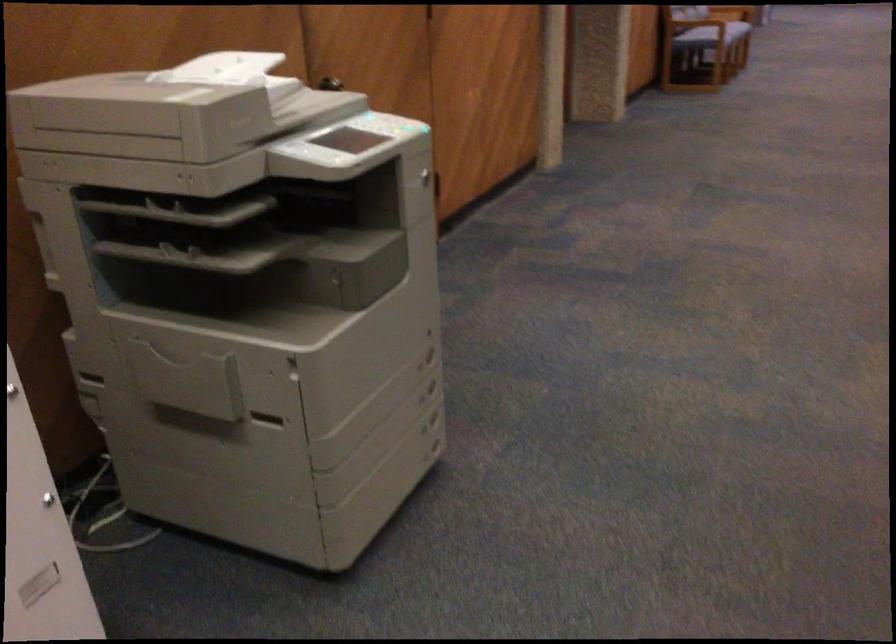
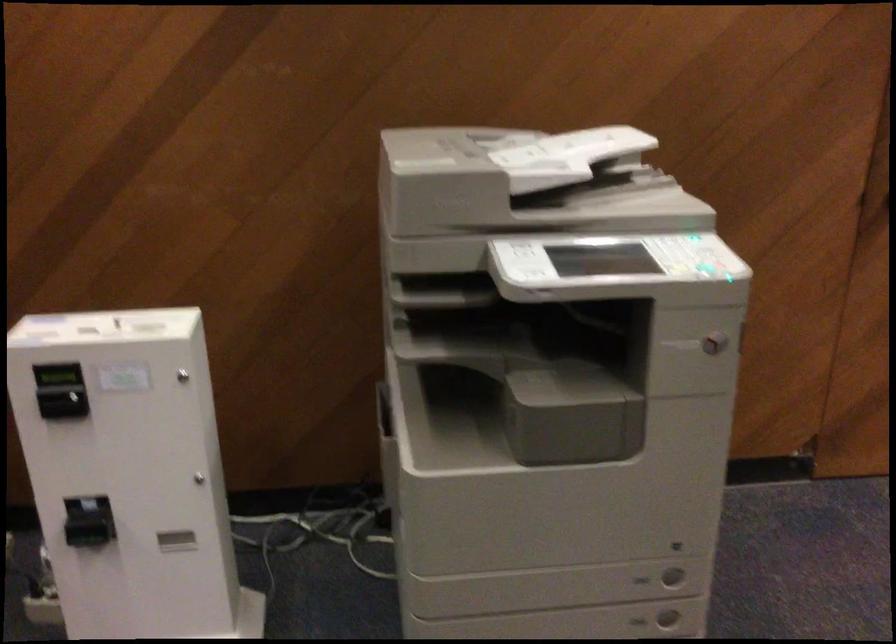
Locate, in the second image, the point that corresponds to point (426, 180) in the first image.

(713, 343)